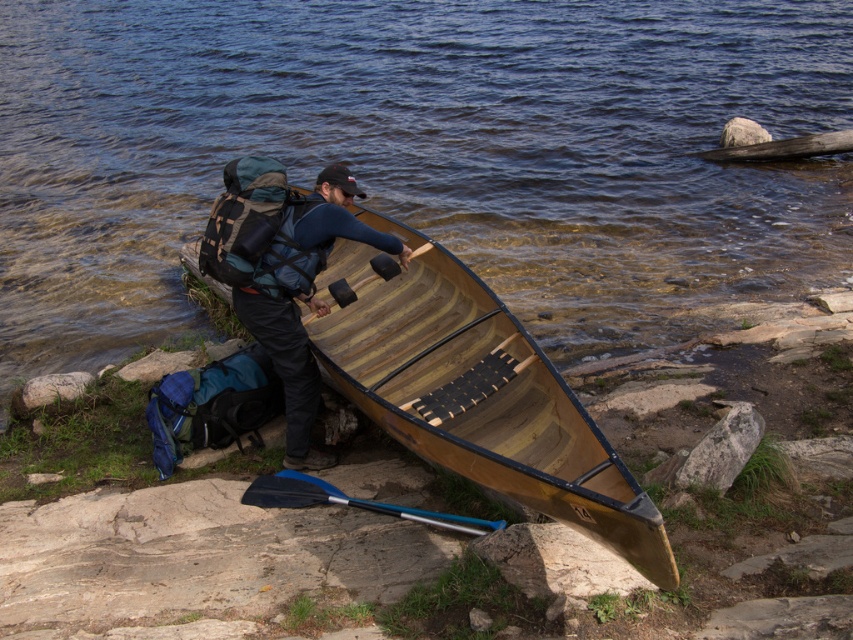
Question: Does wooden canoe at center have a larger size compared to wooden paddle at center?

Choices:
 (A) no
 (B) yes

Answer: (B)

Question: Which object is positioned farthest from the matte black backpack at center?

Choices:
 (A) clear water at center
 (B) wooden paddle at center

Answer: (A)

Question: Which object appears farthest from the camera in this image?

Choices:
 (A) wooden paddle at center
 (B) wooden canoe at center
 (C) clear water at center
 (D) black rubber paddle at lower center

Answer: (C)

Question: Which is nearer to the black rubber paddle at lower center?

Choices:
 (A) clear water at center
 (B) wooden paddle at center
 (C) wooden canoe at center

Answer: (C)

Question: Is the position of wooden canoe at center less distant than that of matte black backpack at center?

Choices:
 (A) no
 (B) yes

Answer: (B)

Question: Can you confirm if wooden canoe at center is smaller than black rubber paddle at lower center?

Choices:
 (A) no
 (B) yes

Answer: (A)